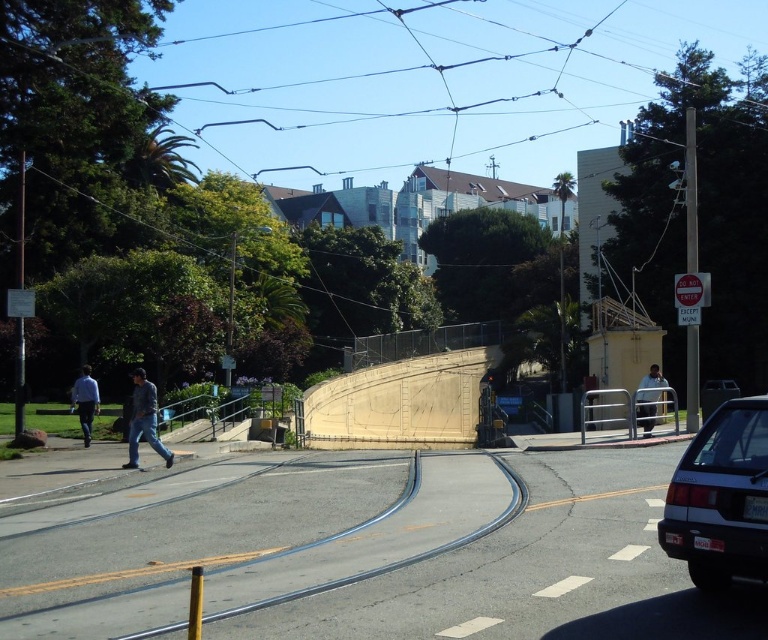
Question: Does white matte car at lower right have a smaller size compared to light blue shirt at left?

Choices:
 (A) yes
 (B) no

Answer: (A)

Question: Which object is positioned closest to the black fabric bag at center?

Choices:
 (A) white matte car at lower right
 (B) metallic wire at upper center

Answer: (A)

Question: Can you confirm if white matte car at lower right is wider than light blue shirt at left?

Choices:
 (A) no
 (B) yes

Answer: (A)

Question: Which object is the farthest from the light blue shirt at left?

Choices:
 (A) black fabric bag at center
 (B) denim jeans at lower left

Answer: (A)

Question: Which point is farther to the camera?

Choices:
 (A) black fabric bag at center
 (B) light blue shirt at left
 (C) metallic wire at upper center
 (D) white matte car at lower right

Answer: (A)

Question: Is light blue shirt at left positioned behind black fabric bag at center?

Choices:
 (A) no
 (B) yes

Answer: (A)